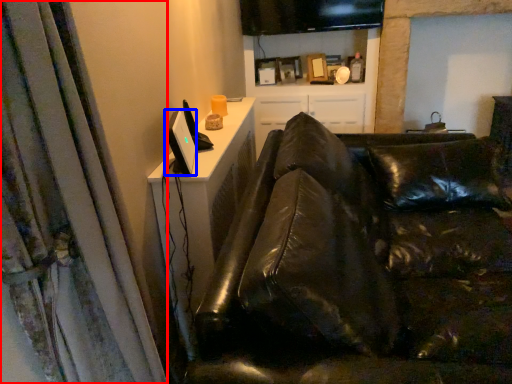
Question: Which object appears farthest to the camera in this image, curtain (highlighted by a red box) or computer monitor (highlighted by a blue box)?

Choices:
 (A) curtain
 (B) computer monitor

Answer: (B)